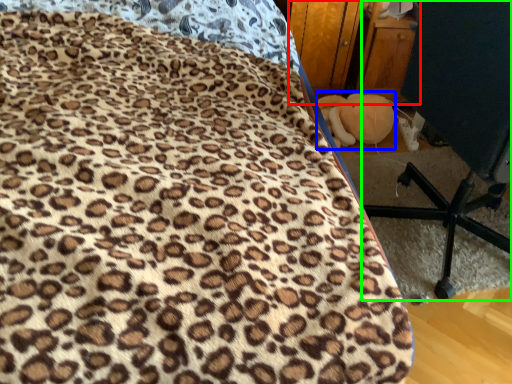
Question: Considering the real-world distances, which object is farthest from dresser (highlighted by a red box)? toy (highlighted by a blue box) or furniture (highlighted by a green box)?

Choices:
 (A) toy
 (B) furniture

Answer: (B)